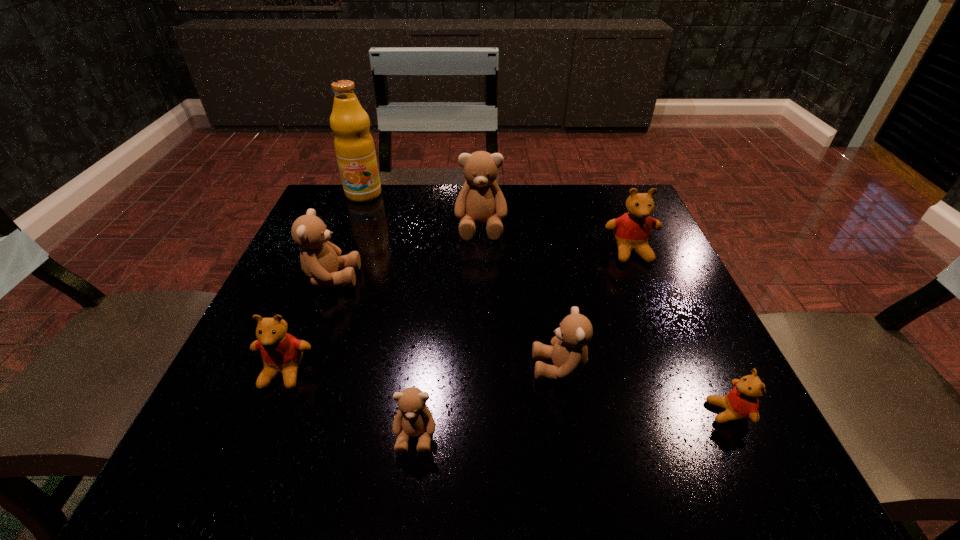
This screenshot has width=960, height=540. In order to click on vacant point located on the front-facing side of the leftmost red teddy bear in this screenshot , I will do `click(252, 451)`.

The width and height of the screenshot is (960, 540). What are the coordinates of `free region located on the front-facing side of the smallest red teddy bear` in the screenshot? It's located at (612, 413).

Find the location of a particular element. Image resolution: width=960 pixels, height=540 pixels. vacant space situated 0.320m on the front-facing side of the smallest red teddy bear is located at coordinates (504, 413).

What are the coordinates of `vacant area situated on the front-facing side of the smallest red teddy bear` in the screenshot? It's located at (568, 413).

Identify the location of fruit juice at the far edge. 354,146.

Where is `teddy bear that is at the far edge`? teddy bear that is at the far edge is located at coordinates (480, 200).

Where is `fruit juice situated at the left edge`? fruit juice situated at the left edge is located at coordinates (354, 146).

Locate an element on the screen. Image resolution: width=960 pixels, height=540 pixels. object positioned at the far left corner is located at coordinates (354, 146).

The image size is (960, 540). I want to click on object that is at the near right corner, so click(741, 403).

In the image, there is a desktop. Identify the location of vacant space at the far edge. The height and width of the screenshot is (540, 960). 442,190.